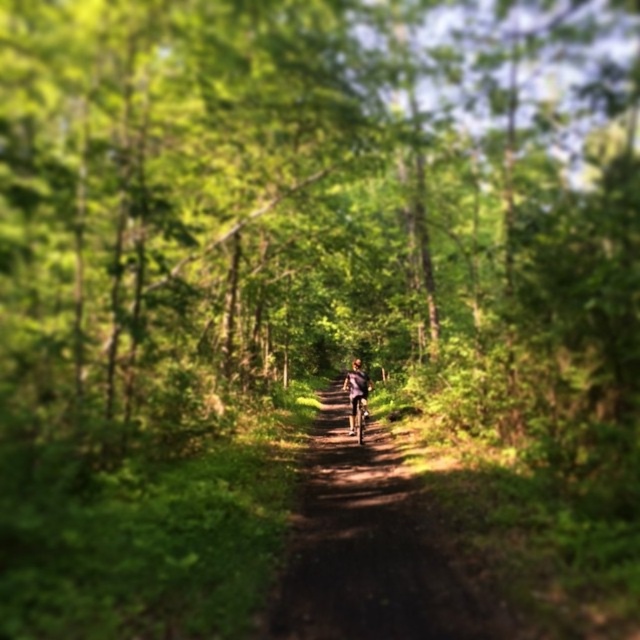
Question: Which of the following is the closest to the observer?

Choices:
 (A) dirt path at center
 (B) shiny metallic bicycle at center
 (C) matte purple jacket at center

Answer: (A)

Question: Does matte purple jacket at center have a larger size compared to shiny metallic bicycle at center?

Choices:
 (A) yes
 (B) no

Answer: (A)

Question: Does dirt path at center lie behind matte purple jacket at center?

Choices:
 (A) yes
 (B) no

Answer: (B)

Question: Does matte purple jacket at center come in front of shiny metallic bicycle at center?

Choices:
 (A) yes
 (B) no

Answer: (B)

Question: Which object appears farthest from the camera in this image?

Choices:
 (A) dirt path at center
 (B) matte purple jacket at center

Answer: (B)

Question: Which of the following is the farthest from the observer?

Choices:
 (A) dirt path at center
 (B) matte purple jacket at center

Answer: (B)